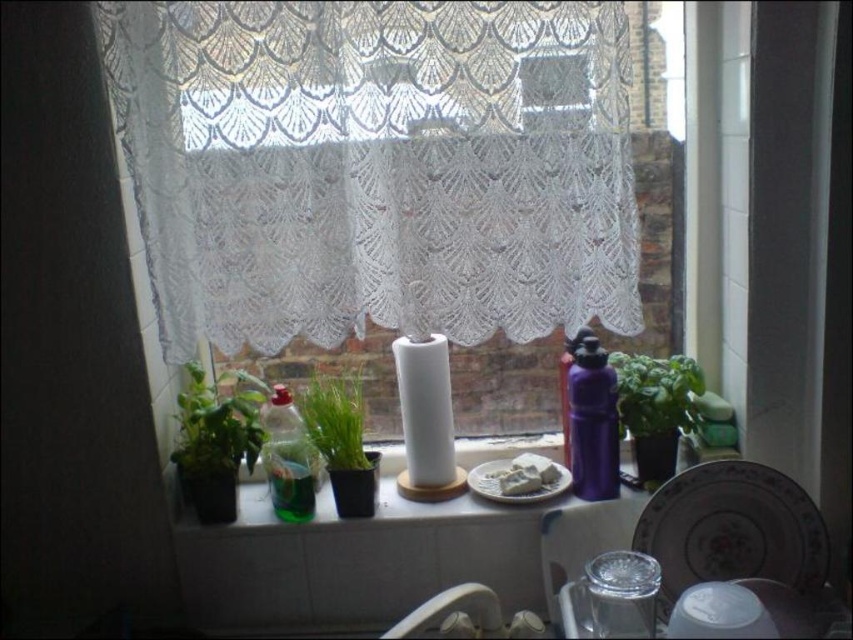
Question: Which point is farther from the camera taking this photo?

Choices:
 (A) (463, 508)
 (B) (486, 621)

Answer: (A)

Question: Can you confirm if green leafy plant at left is positioned above green matte plant at center?

Choices:
 (A) yes
 (B) no

Answer: (A)

Question: Is green glass bottle at center behind white glossy sink at lower center?

Choices:
 (A) yes
 (B) no

Answer: (A)

Question: Which point is farther to the camera?

Choices:
 (A) (486, 493)
 (B) (389, 634)

Answer: (A)

Question: Which object is positioned closest to the green glass bottle at center?

Choices:
 (A) white matte plate at center
 (B) white lace curtain at center
 (C) green matte plant at center

Answer: (A)

Question: Can you confirm if white ceramic plate at lower right is positioned below purple matte water bottle at right?

Choices:
 (A) no
 (B) yes

Answer: (B)